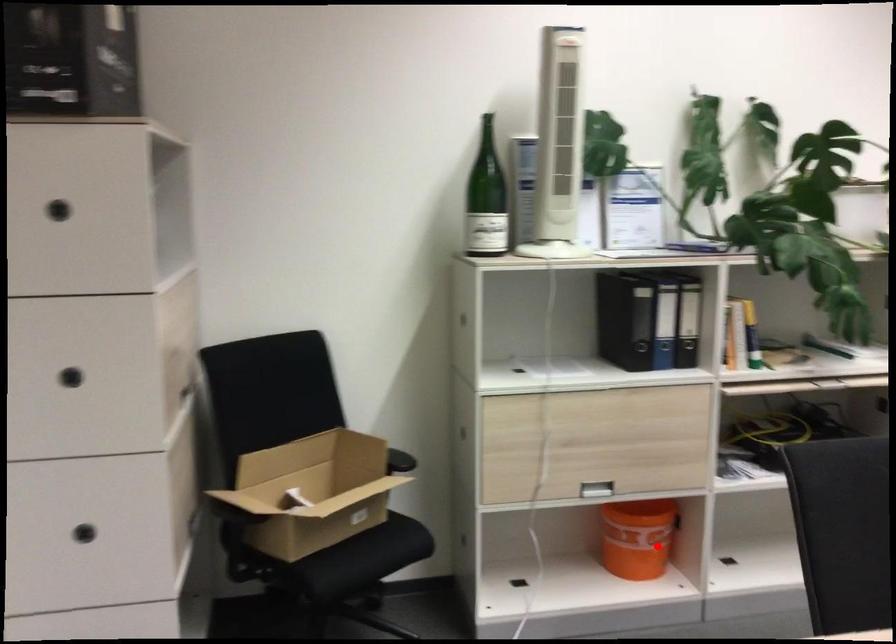
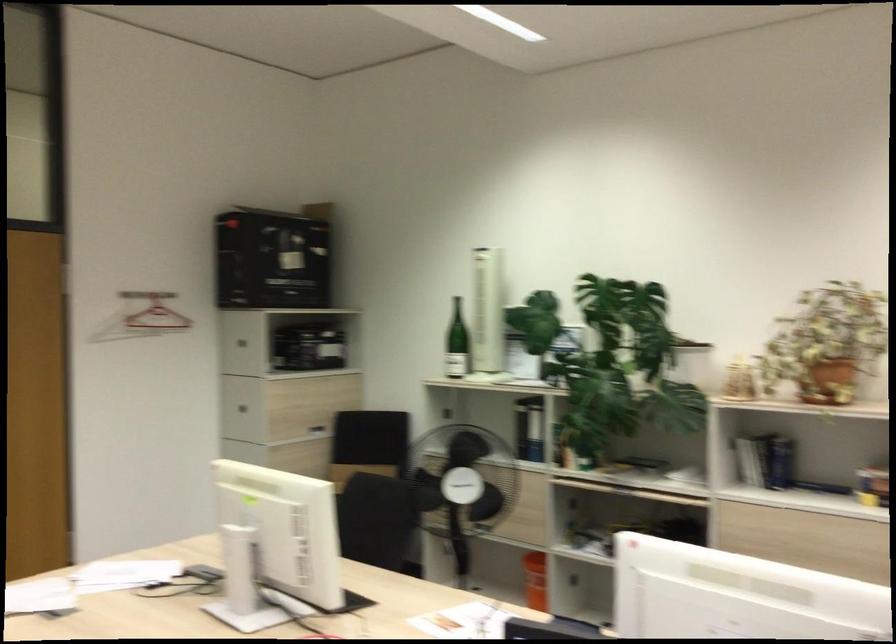
Find the pixel in the second image that matches the highlighted location in the first image.

(535, 580)